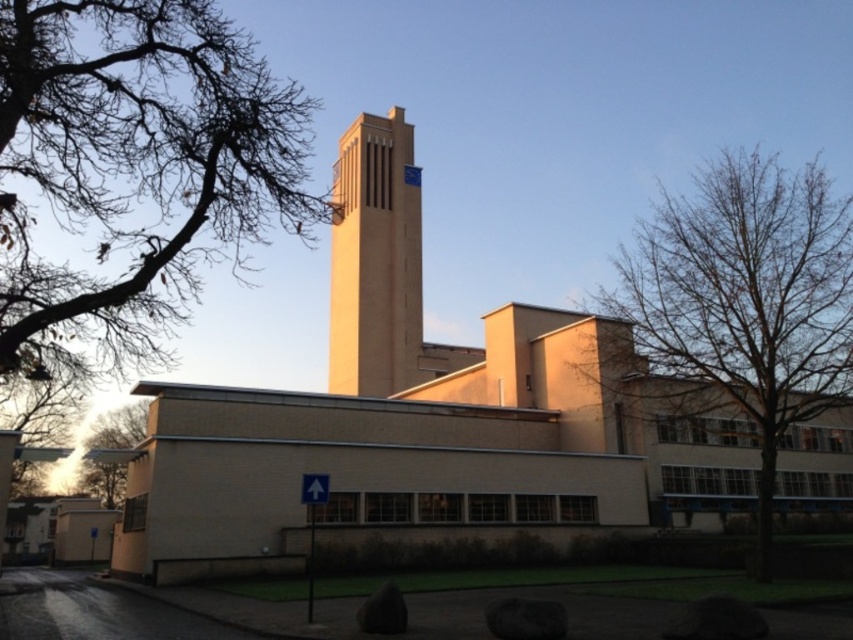
Question: Among these objects, which one is farthest from the camera?

Choices:
 (A) bare wood tree at center
 (B) beige brick tower at center
 (C) beige concrete church at center

Answer: (B)

Question: Which of the following is the farthest from the observer?

Choices:
 (A) (386, 355)
 (B) (808, 456)

Answer: (A)

Question: Which object is positioned closest to the bare wood tree at center?

Choices:
 (A) beige concrete church at center
 (B) green leafy tree at lower left

Answer: (A)

Question: Is bare wood tree at center further to camera compared to beige brick tower at center?

Choices:
 (A) yes
 (B) no

Answer: (B)

Question: Is bare wood tree at center above beige brick tower at center?

Choices:
 (A) no
 (B) yes

Answer: (B)

Question: Does bare wood tree at center have a larger size compared to beige brick tower at center?

Choices:
 (A) yes
 (B) no

Answer: (A)